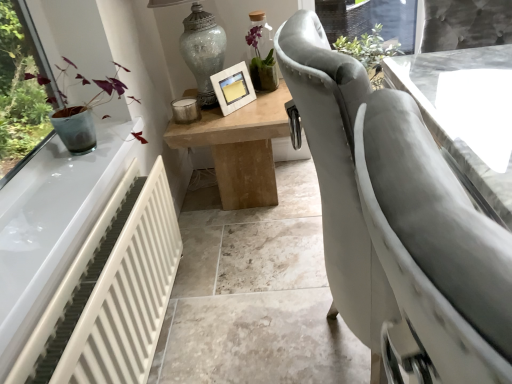
You are a GUI agent. You are given a task and a screenshot of the screen. Output one action in this format:
    pyautogui.click(x=<x>, y=<y>)
    Task: Click on the vacant space underneath light brown wooden table at center, placed as the 2th table when sorted from right to left (from a real-world perspective)
    This screenshot has width=512, height=384.
    Given the screenshot: What is the action you would take?
    pyautogui.click(x=253, y=205)